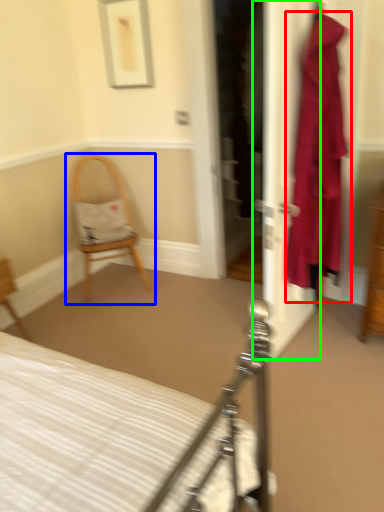
Question: Estimate the real-world distances between objects in this image. Which object is closer to clothing (highlighted by a red box), chair (highlighted by a blue box) or door (highlighted by a green box)?

Choices:
 (A) chair
 (B) door

Answer: (B)